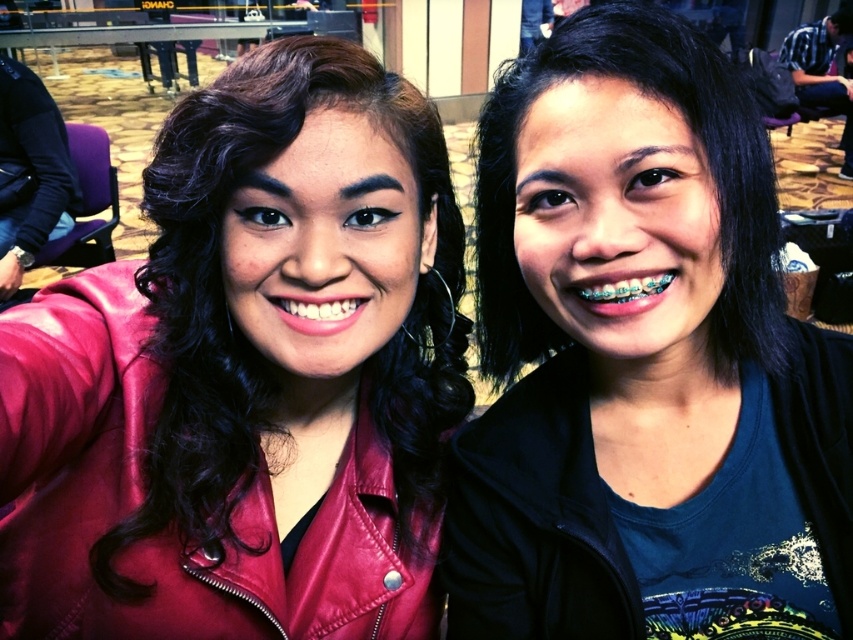
Based on the photo, you are a fashion designer observing the two individuals in the image. You need to determine which item of clothing is bigger between the matte leather jacket at left and the teethmetallicmouth at right. Which one is larger?

The matte leather jacket at left is larger in size compared to the teethmetallicmouth at right.